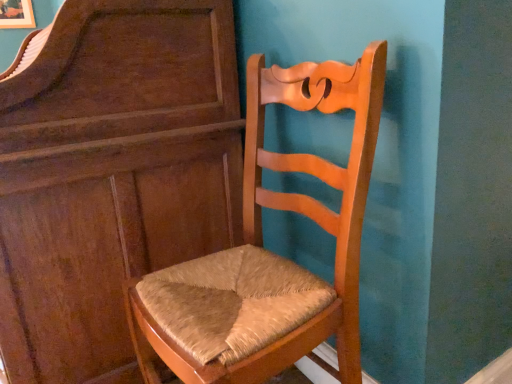
Where is `light brown wood chair at center`? The image size is (512, 384). light brown wood chair at center is located at coordinates (271, 252).

The width and height of the screenshot is (512, 384). Describe the element at coordinates (271, 252) in the screenshot. I see `light brown wood chair at center` at that location.

Locate an element on the screen. matte brown dresser at center is located at coordinates (111, 175).

The image size is (512, 384). Describe the element at coordinates (111, 175) in the screenshot. I see `matte brown dresser at center` at that location.

Identify the location of light brown wood chair at center. The height and width of the screenshot is (384, 512). (271, 252).

Looking at this image, is light brown wood chair at center to the left of matte brown dresser at center from the viewer's perspective?

In fact, light brown wood chair at center is to the right of matte brown dresser at center.

Which object is closer to the camera, light brown wood chair at center or matte brown dresser at center?

Positioned in front is light brown wood chair at center.

Which is in front, point (276, 154) or point (106, 34)?

The point (106, 34) is closer.

From the image's perspective, is light brown wood chair at center on top of matte brown dresser at center?

No.

From a real-world perspective, which is physically below, light brown wood chair at center or matte brown dresser at center?

In real-world perspective, light brown wood chair at center is lower.

Is light brown wood chair at center wider than matte brown dresser at center?

In fact, light brown wood chair at center might be narrower than matte brown dresser at center.

Between light brown wood chair at center and matte brown dresser at center, which one has more height?

matte brown dresser at center is taller.

Can you confirm if light brown wood chair at center is bigger than matte brown dresser at center?

Incorrect, light brown wood chair at center is not larger than matte brown dresser at center.

Do you think light brown wood chair at center is within matte brown dresser at center, or outside of it?

light brown wood chair at center is located beyond the bounds of matte brown dresser at center.

Are light brown wood chair at center and matte brown dresser at center making contact?

light brown wood chair at center and matte brown dresser at center are not in contact.

Does light brown wood chair at center turn towards matte brown dresser at center?

No, light brown wood chair at center is not facing towards matte brown dresser at center.

Can you tell me how much light brown wood chair at center and matte brown dresser at center differ in facing direction?

1.07 degrees.

You are a GUI agent. You are given a task and a screenshot of the screen. Output one action in this format:
    pyautogui.click(x=<x>, y=<y>)
    Task: Click on the chair lying below the matte brown dresser at center (from the image's perspective)
    The height and width of the screenshot is (384, 512).
    Given the screenshot: What is the action you would take?
    pyautogui.click(x=271, y=252)

Based on the photo, considering the relative positions of matte brown dresser at center and light brown wood chair at center in the image provided, is matte brown dresser at center to the right of light brown wood chair at center from the viewer's perspective?

Incorrect, matte brown dresser at center is not on the right side of light brown wood chair at center.

Relative to light brown wood chair at center, is matte brown dresser at center in front or behind?

matte brown dresser at center is behind light brown wood chair at center.

Which is closer, (119, 115) or (225, 358)?

Point (225, 358)

From the image's perspective, is matte brown dresser at center below light brown wood chair at center?

Actually, matte brown dresser at center appears above light brown wood chair at center in the image.

From a real-world perspective, is matte brown dresser at center physically located above or below light brown wood chair at center?

From a real-world perspective, matte brown dresser at center is physically above light brown wood chair at center.

Considering the relative sizes of matte brown dresser at center and light brown wood chair at center in the image provided, is matte brown dresser at center wider than light brown wood chair at center?

Yes.

Does matte brown dresser at center have a lesser height compared to light brown wood chair at center?

In fact, matte brown dresser at center may be taller than light brown wood chair at center.

Considering the sizes of matte brown dresser at center and light brown wood chair at center in the image, is matte brown dresser at center bigger or smaller than light brown wood chair at center?

Clearly, matte brown dresser at center is larger in size than light brown wood chair at center.

Is matte brown dresser at center not inside light brown wood chair at center?

That's correct, matte brown dresser at center is outside of light brown wood chair at center.

Is matte brown dresser at center directly adjacent to light brown wood chair at center?

matte brown dresser at center and light brown wood chair at center are clearly separated.

Is matte brown dresser at center facing away from light brown wood chair at center?

That's not correct — matte brown dresser at center is not looking away from light brown wood chair at center.

How far apart are matte brown dresser at center and light brown wood chair at center?

matte brown dresser at center is 12.21 inches away from light brown wood chair at center.

In order to click on chair below the matte brown dresser at center (from the image's perspective) in this screenshot , I will do `click(271, 252)`.

Image resolution: width=512 pixels, height=384 pixels. I want to click on chair in front of the matte brown dresser at center, so click(x=271, y=252).

Image resolution: width=512 pixels, height=384 pixels. I want to click on dresser behind the light brown wood chair at center, so click(111, 175).